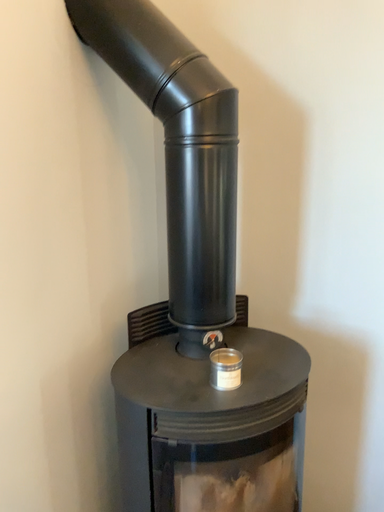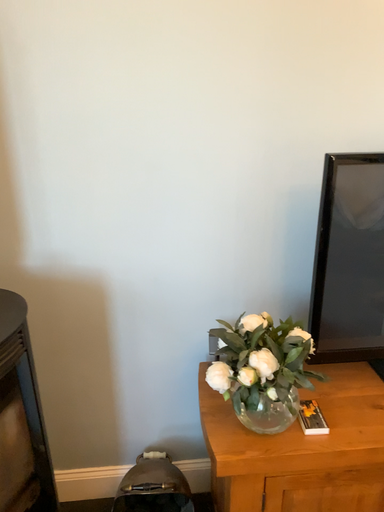
Question: How did the camera likely rotate when shooting the video?

Choices:
 (A) rotated left
 (B) rotated right

Answer: (B)